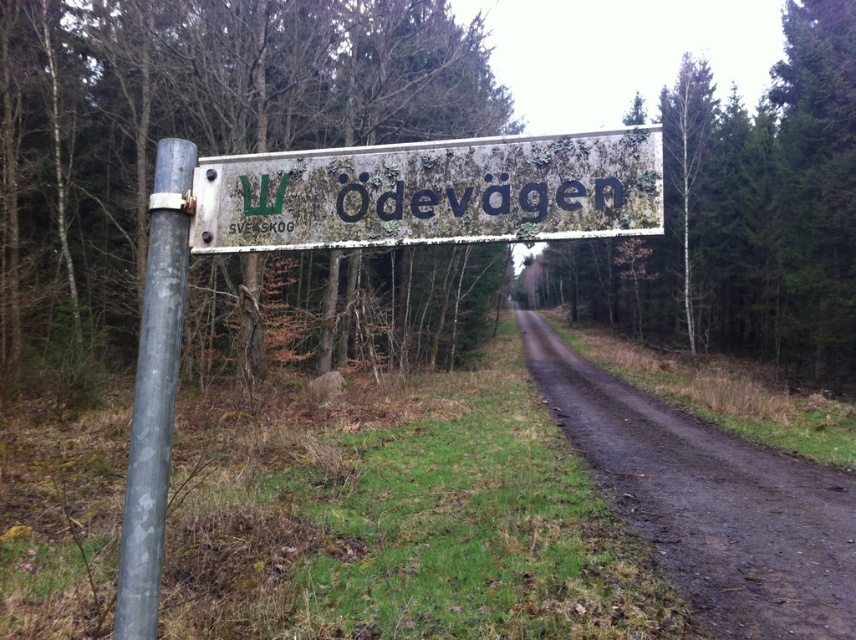
You are a hiker trying to read the signs near the center of the image. You see the green mossy sign at center and the rusty metal sign at center. Which one do you think is bigger?

The green mossy sign at center has a larger size compared to the rusty metal sign at center, so the green mossy sign at center is bigger.

You are a hiker trying to read the signs near the path. You see the green mossy sign at center and the rusty metal sign at center. Which one is closer to you?

The green mossy sign at center is closer to you because it is further to the viewer than the rusty metal sign at center.

You are a hiker trying to determine the best path forward. You see a rusty metal sign at center and a brown dirt track at center. Which object is closer to you?

The brown dirt track at center is closer to you because the rusty metal sign at center is behind it.